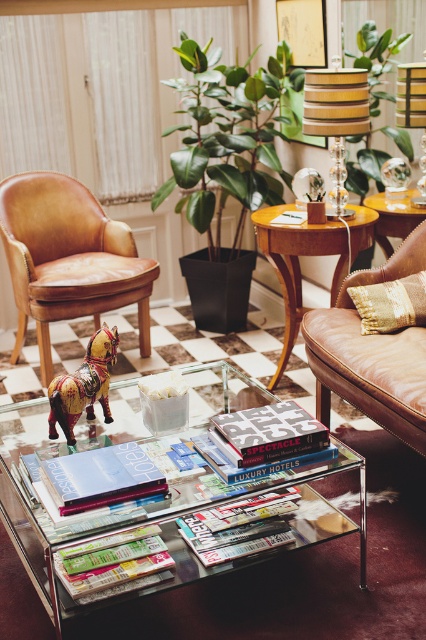
You are standing in the living room and want to move from the sofa on the right to the coffee table. Which direction should you move relative to the matte brown leather armchair at left?

Since the matte brown leather armchair at left is located at point (68,259), you should move towards the left side of the armchair to reach the coffee table from the sofa on the right.

You are planning to rearrange the living room and want to place a 1.2 meter wide bookshelf between the matte brown leather armchair at left and the leather couch at right. Considering their widths, will the bookshelf fit in the space between them?

The matte brown leather armchair at left is wider than the leather couch at right, so the space between them may not be sufficient to accommodate a 1.2 meter wide bookshelf. Measure the exact distance to confirm.

You are arranging a small shelf in your home and want to place the green matte plant at center and the matte hardcover book at center on it. Since the shelf has limited vertical space, which item should you place first to ensure both fit?

The matte hardcover book at center should be placed first because the green matte plant at center is taller, so placing the shorter item first allows room for the taller plant on the shelf.